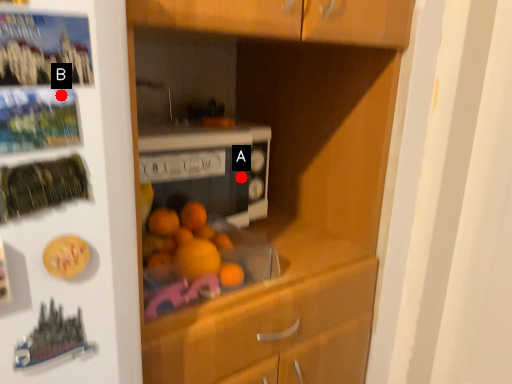
Question: Two points are circled on the image, labeled by A and B beside each circle. Which point appears farthest from the camera in this image?

Choices:
 (A) A is further
 (B) B is further

Answer: (A)